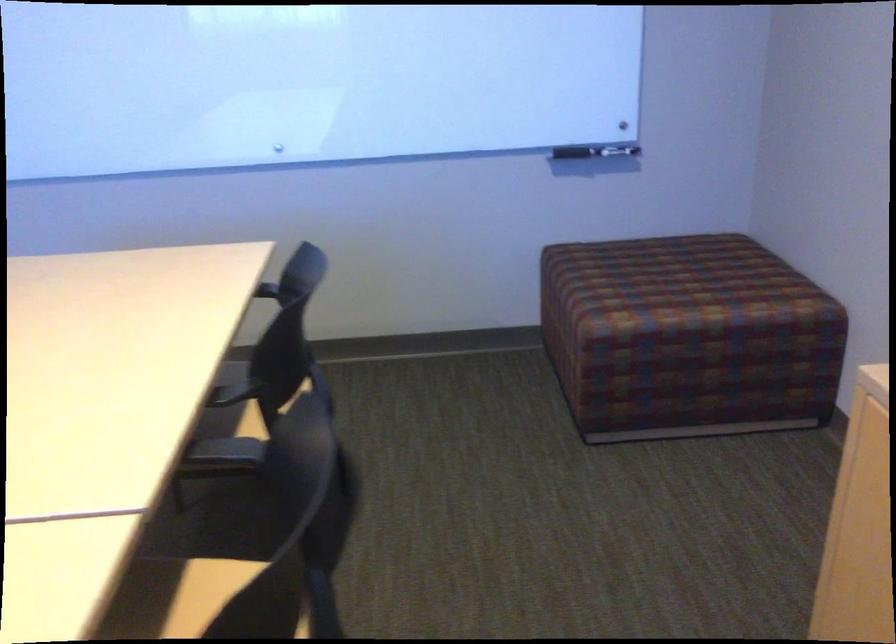
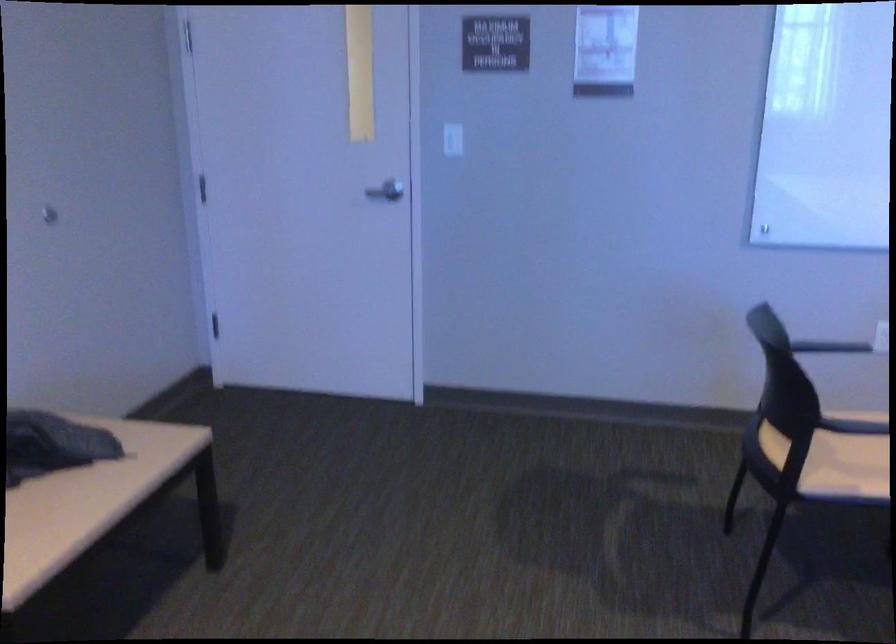
Question: What movement of the cameraman would produce the second image?

Choices:
 (A) Left
 (B) Right
 (C) Forward
 (D) Backward

Answer: (A)